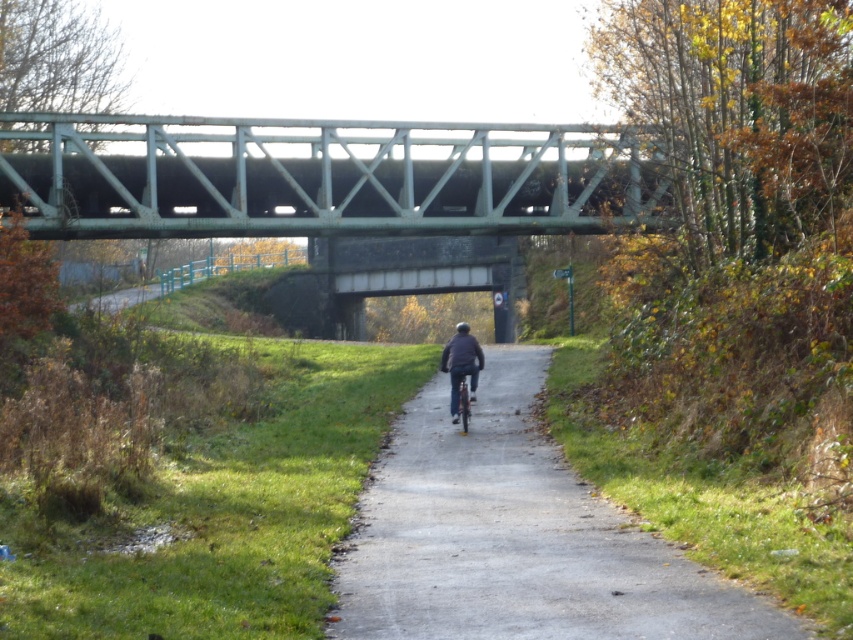
Is green painted steel bridge at upper center further to the viewer compared to metallic silver bicycle at center?

Yes, green painted steel bridge at upper center is further from the viewer.

Is green painted steel bridge at upper center in front of metallic silver bicycle at center?

No, it is behind metallic silver bicycle at center.

Is point (639, 154) behind point (466, 392)?

Yes, point (639, 154) is farther from viewer.

Locate an element on the screen. The height and width of the screenshot is (640, 853). green painted steel bridge at upper center is located at coordinates (325, 177).

Consider the image. Can you confirm if green painted steel bridge at upper center is smaller than dark blue jacket at center?

No, green painted steel bridge at upper center is not smaller than dark blue jacket at center.

Does green painted steel bridge at upper center lie in front of dark blue jacket at center?

No, green painted steel bridge at upper center is behind dark blue jacket at center.

Is point (619, 198) positioned in front of point (467, 358)?

That is False.

The width and height of the screenshot is (853, 640). I want to click on green painted steel bridge at upper center, so click(x=325, y=177).

Who is positioned more to the left, dark blue jacket at center or metallic silver bicycle at center?

dark blue jacket at center is more to the left.

Who is more distant from viewer, (453, 392) or (474, 385)?

Point (474, 385)

The width and height of the screenshot is (853, 640). What are the coordinates of `dark blue jacket at center` in the screenshot? It's located at (461, 364).